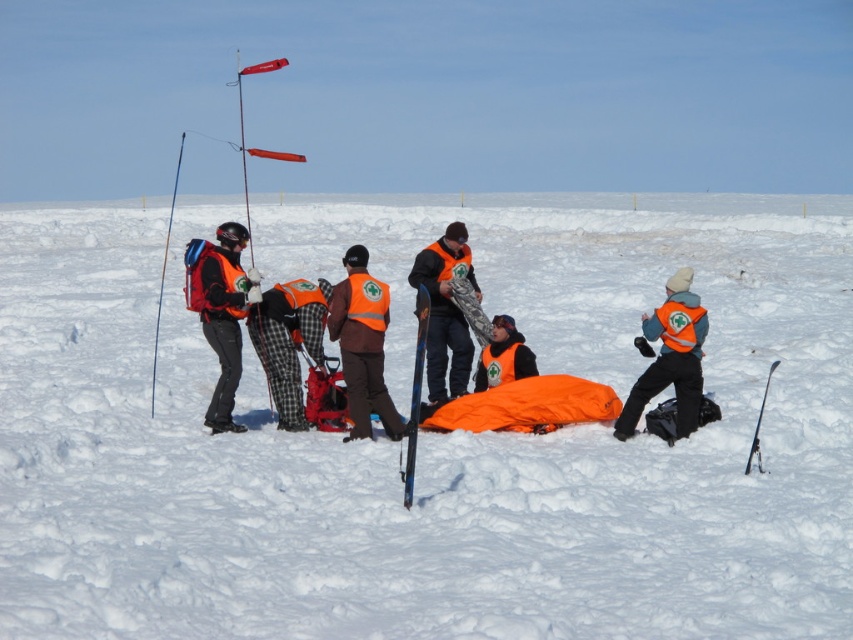
Can you confirm if brown fabric jacket at center is thinner than orange reflective vest at center?

Correct, brown fabric jacket at center's width is less than orange reflective vest at center's.

Looking at this image, which of these two, brown fabric jacket at center or orange reflective vest at center, stands taller?

orange reflective vest at center is taller.

Is point (354, 268) less distant than point (459, 237)?

Yes, point (354, 268) is in front of point (459, 237).

The height and width of the screenshot is (640, 853). I want to click on brown fabric jacket at center, so click(363, 346).

Between brown fabric jacket at center and matte orange vest at center, which one has more height?

matte orange vest at center is taller.

Where is `brown fabric jacket at center`? brown fabric jacket at center is located at coordinates (363, 346).

Locate an element on the screen. The height and width of the screenshot is (640, 853). brown fabric jacket at center is located at coordinates (363, 346).

Does matte orange vest at center have a greater height compared to orange fleece jacket at center?

Indeed, matte orange vest at center has a greater height compared to orange fleece jacket at center.

From the picture: Does matte orange vest at center have a lesser width compared to orange fleece jacket at center?

No.

Is point (672, 328) farther from camera compared to point (502, 342)?

No, it is not.

Locate an element on the screen. Image resolution: width=853 pixels, height=640 pixels. matte orange vest at center is located at coordinates (669, 356).